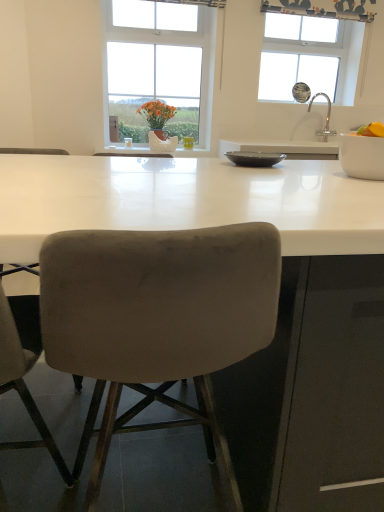
Identify the location of vacant point above transparent glass window at upper right, marked as the first window in a right-to-left arrangement (from a real-world perspective). coord(304,10).